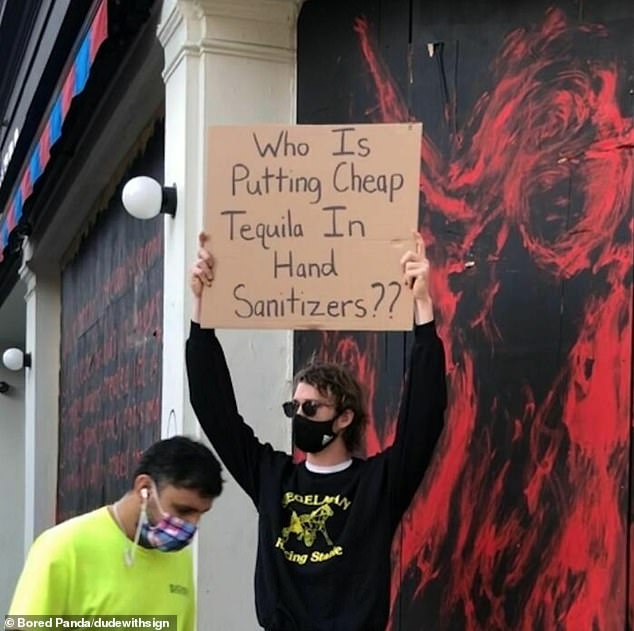
At what (x,y) coordinates should I click in order to perform the action: click on white pillars. Please return your answer as a coordinate pair (x, y). Image resolution: width=634 pixels, height=631 pixels. Looking at the image, I should click on (221, 55), (40, 298).